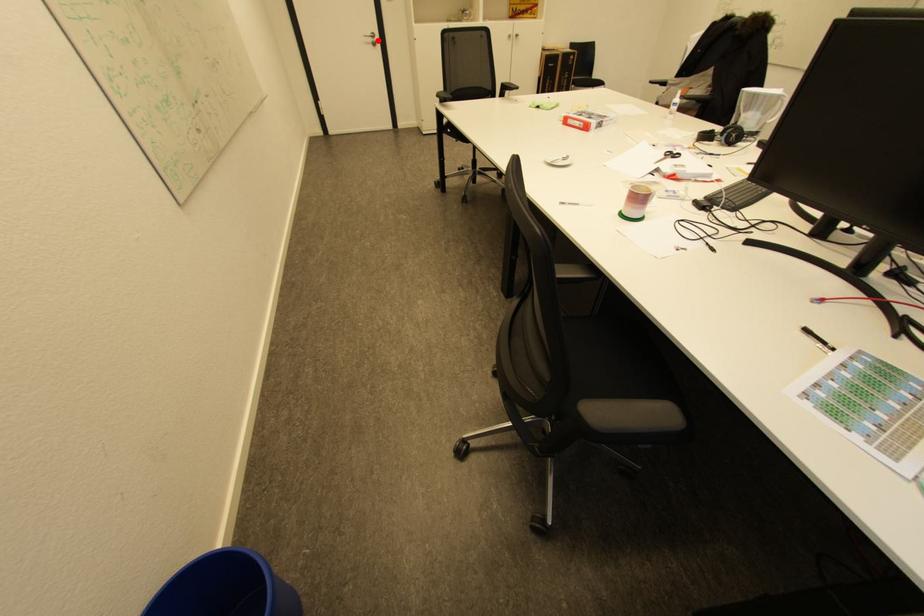
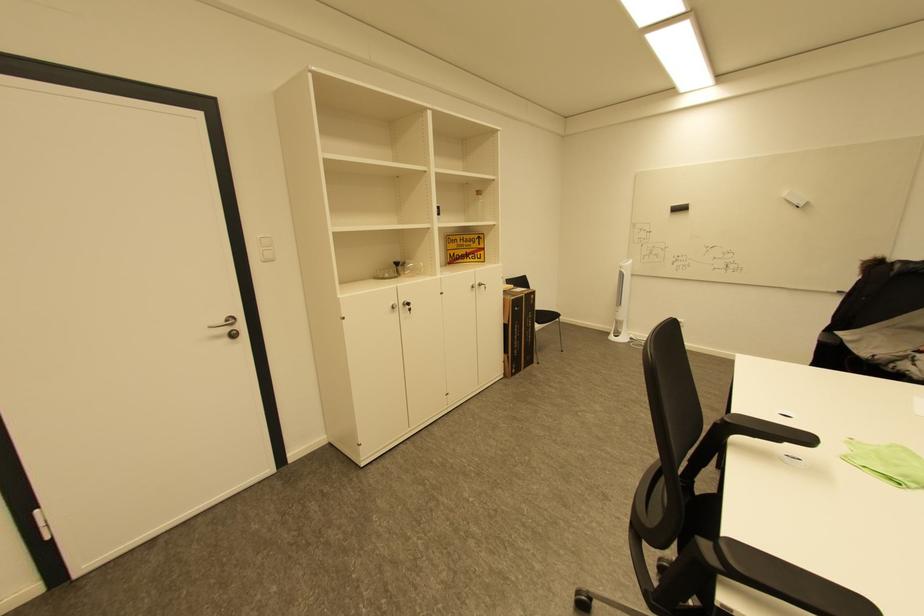
Find the pixel in the second image that matches the highlighted location in the first image.

(233, 330)